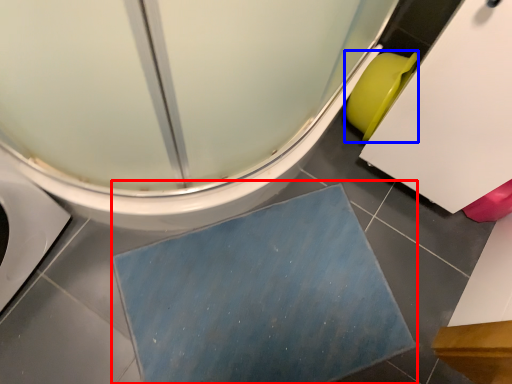
Question: Which point is further to the camera, bath mat (highlighted by a red box) or toilet bowl (highlighted by a blue box)?

Choices:
 (A) bath mat
 (B) toilet bowl

Answer: (B)